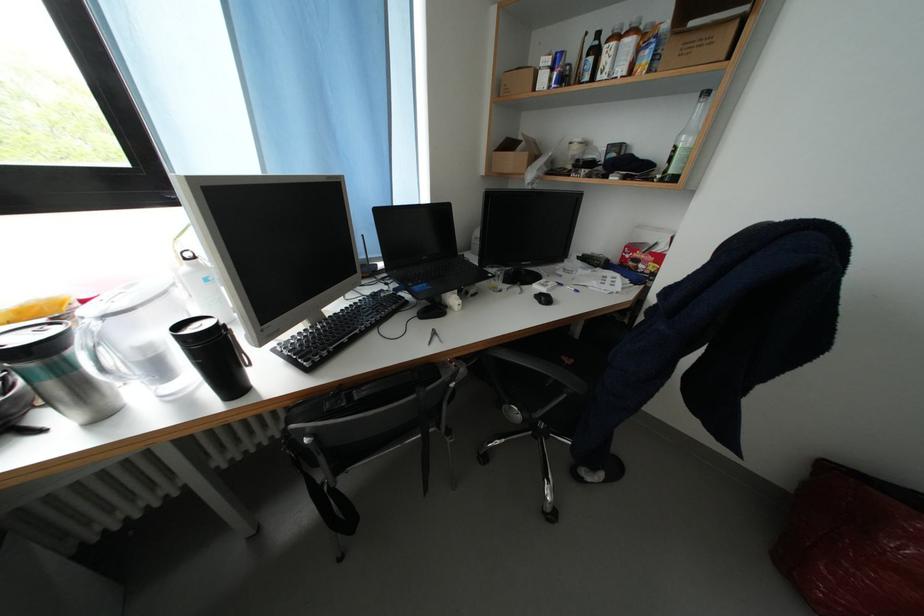
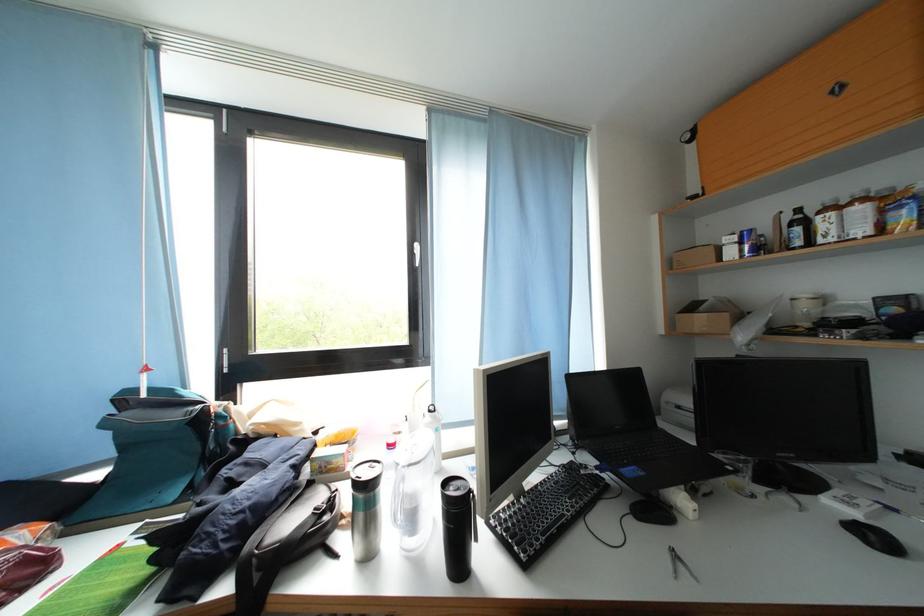
Where in the second image is the point corresponding to point (492, 282) from the first image?

(727, 474)